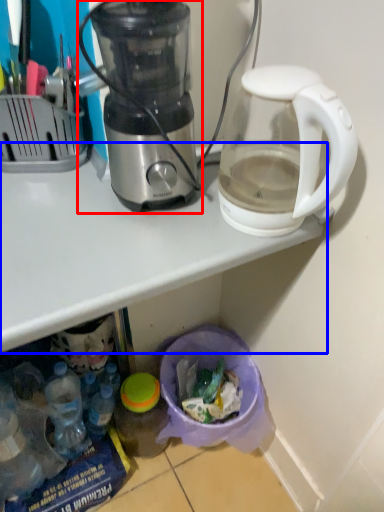
Question: Among these objects, which one is nearest to the camera, blender (highlighted by a red box) or table (highlighted by a blue box)?

Choices:
 (A) blender
 (B) table

Answer: (B)